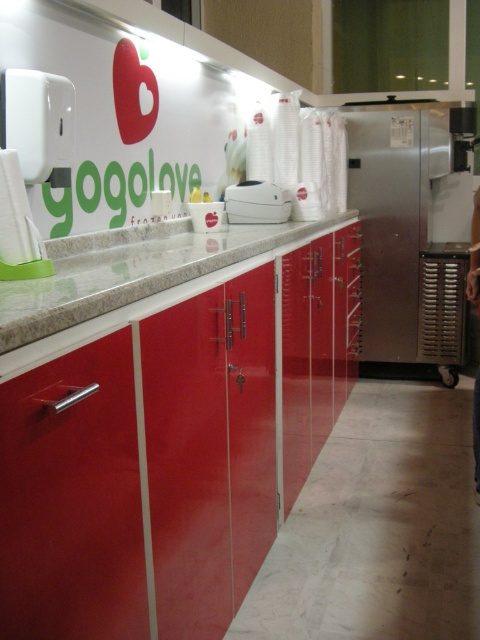
Is point (415, 134) positioned after point (218, 256)?

Yes, point (415, 134) is farther from viewer.

Describe the element at coordinates (411, 230) in the screenshot. The image size is (480, 640). I see `stainless steel refrigerator at right` at that location.

The height and width of the screenshot is (640, 480). In order to click on stainless steel refrigerator at right in this screenshot , I will do `click(411, 230)`.

Is point (363, 358) in front of point (237, 192)?

No, it is not.

Locate an element on the screen. This screenshot has width=480, height=640. stainless steel refrigerator at right is located at coordinates (411, 230).

Identify the location of stainless steel refrigerator at right. (411, 230).

Which of these two, granite countertop at center or white plastic toaster at center, stands shorter?

With less height is white plastic toaster at center.

Is granite countertop at center positioned before white plastic toaster at center?

Yes.

Between point (39, 301) and point (271, 202), which one is positioned behind?

The point (271, 202) is behind.

Where is `granite countertop at center`? granite countertop at center is located at coordinates (130, 269).